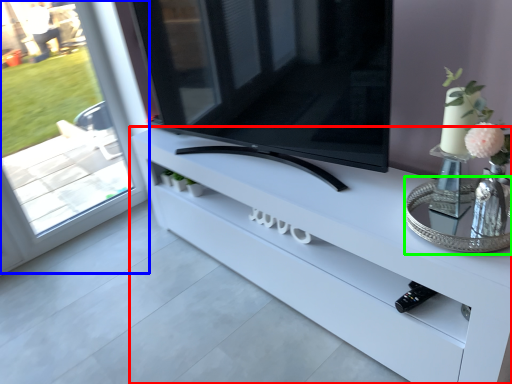
Question: Which object is positioned farthest from furniture (highlighted by a red box)? Select from window (highlighted by a blue box) and glass table (highlighted by a green box).

Choices:
 (A) window
 (B) glass table

Answer: (A)